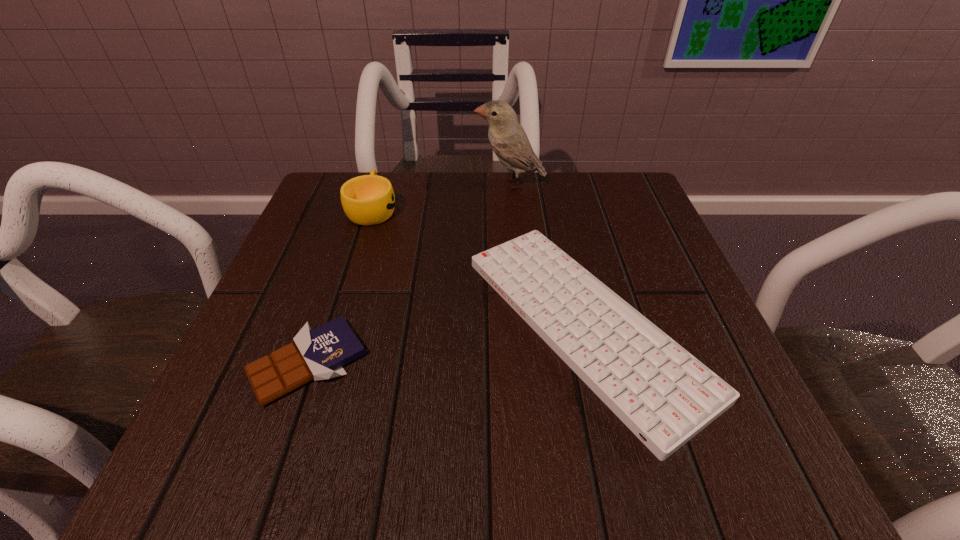
Identify the location of bird situated at the far edge. (507, 137).

Where is `cup that is positioned at the far edge`? This screenshot has width=960, height=540. cup that is positioned at the far edge is located at coordinates (367, 200).

This screenshot has width=960, height=540. Identify the location of object located at the near edge. (663, 394).

At what (x,y) coordinates should I click in order to perform the action: click on cup at the left edge. Please return your answer as a coordinate pair (x, y). The width and height of the screenshot is (960, 540). Looking at the image, I should click on (367, 200).

Identify the location of chocolate bar located in the left edge section of the desktop. (319, 354).

Where is `object that is at the right edge`? The image size is (960, 540). object that is at the right edge is located at coordinates (663, 394).

Locate an element on the screen. Image resolution: width=960 pixels, height=540 pixels. object that is at the far left corner is located at coordinates (367, 200).

This screenshot has height=540, width=960. What are the coordinates of `object located in the near right corner section of the desktop` in the screenshot? It's located at (663, 394).

Identify the location of vacant space at the far edge of the desktop. The width and height of the screenshot is (960, 540). (552, 198).

Locate an element on the screen. The image size is (960, 540). vacant space at the near edge of the desktop is located at coordinates (591, 417).